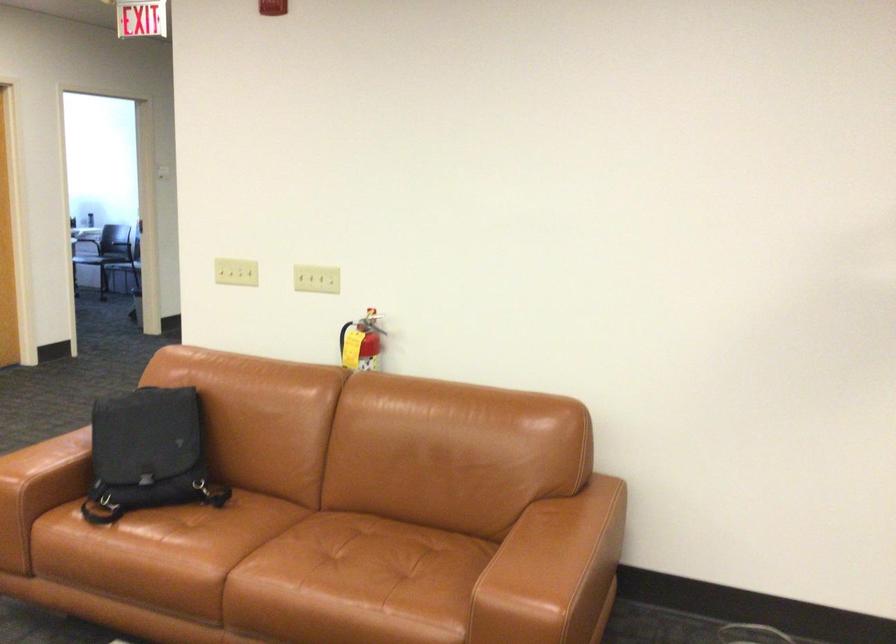
You are a GUI agent. You are given a task and a screenshot of the screen. Output one action in this format:
    pyautogui.click(x=<x>, y=<y>)
    Task: Click on the sofa armrest
    Image resolution: width=896 pixels, height=644 pixels.
    Given the screenshot: What is the action you would take?
    pyautogui.click(x=49, y=467)